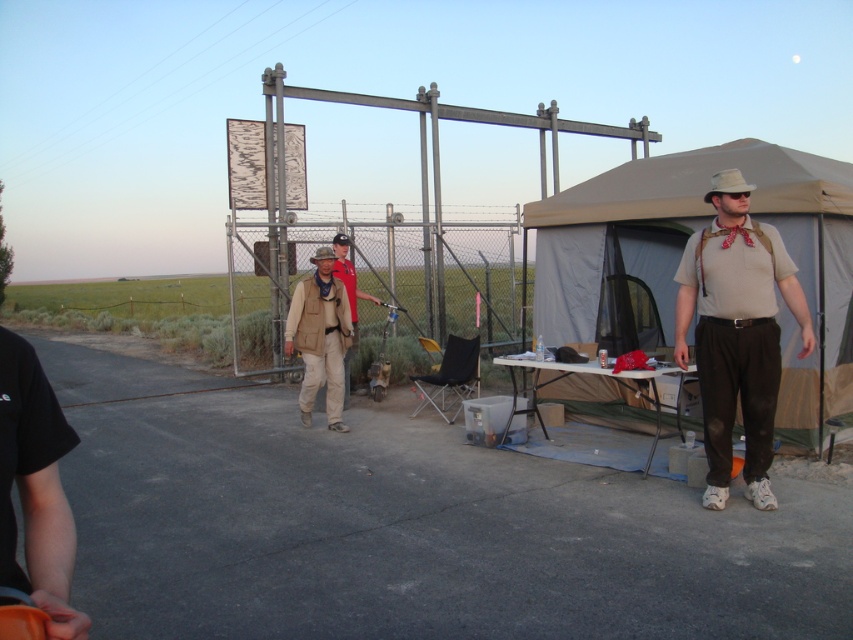
Is tan canvas tent at right wider than matte khaki shirt at right?

No.

Can you confirm if tan canvas tent at right is positioned above matte khaki shirt at right?

No.

Between point (785, 324) and point (747, 216), which one is positioned in front?

Positioned in front is point (747, 216).

Find the location of a particular element. The height and width of the screenshot is (640, 853). tan canvas tent at right is located at coordinates (680, 256).

Where is `tan fabric vest at center`? The height and width of the screenshot is (640, 853). tan fabric vest at center is located at coordinates (320, 337).

Is point (317, 385) positioned in front of point (341, 269)?

Yes, point (317, 385) is closer to viewer.

Which is in front, point (335, 426) or point (339, 237)?

Point (335, 426) is in front.

Find the location of `tan fabric vest at center`. tan fabric vest at center is located at coordinates (320, 337).

Between tan canvas tent at right and tan fabric vest at center, which one has less height?

tan canvas tent at right

Between tan canvas tent at right and tan fabric vest at center, which one appears on the left side from the viewer's perspective?

tan fabric vest at center

Between point (607, 256) and point (345, 333), which one is positioned behind?

The point (345, 333) is more distant.

The image size is (853, 640). In order to click on tan canvas tent at right in this screenshot , I will do `click(680, 256)`.